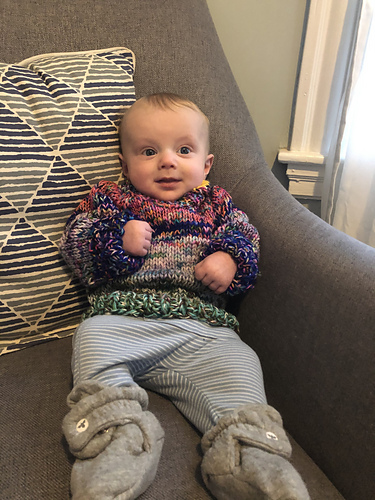
I want to click on pillow, so [56, 152].